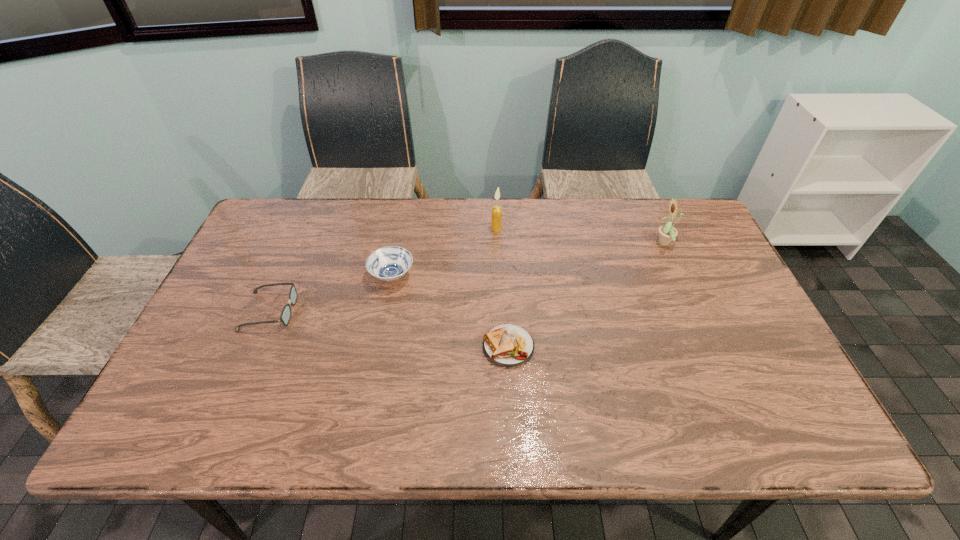
The image size is (960, 540). I want to click on free spot at the far edge of the desktop, so 548,220.

Find the location of a particular element. The width and height of the screenshot is (960, 540). free region at the near edge of the desktop is located at coordinates click(x=253, y=427).

The image size is (960, 540). I want to click on vacant area at the left edge, so click(277, 279).

Where is `free location at the right edge`? This screenshot has width=960, height=540. free location at the right edge is located at coordinates (763, 373).

In the image, there is a desktop. Where is `vacant space at the far left corner`? This screenshot has width=960, height=540. vacant space at the far left corner is located at coordinates (307, 212).

Find the location of a particular element. This screenshot has width=960, height=540. vacant space at the near left corner of the desktop is located at coordinates (180, 437).

You are a GUI agent. You are given a task and a screenshot of the screen. Output one action in this format:
    pyautogui.click(x=<x>, y=<y>)
    Task: Click on the vacant space in between the leftmost object and the soup bowl
    Image resolution: width=960 pixels, height=540 pixels.
    Given the screenshot: What is the action you would take?
    pyautogui.click(x=331, y=294)

At what (x,y) coordinates should I click in order to perform the action: click on free space between the second farthest object and the sandwich. Please return your answer as a coordinate pair (x, y). The image size is (960, 540). Looking at the image, I should click on (587, 295).

In order to click on free space that is in between the sunflower and the candle in this screenshot , I will do `click(581, 237)`.

Identify the location of free area in between the rightmost object and the third shortest object. (529, 260).